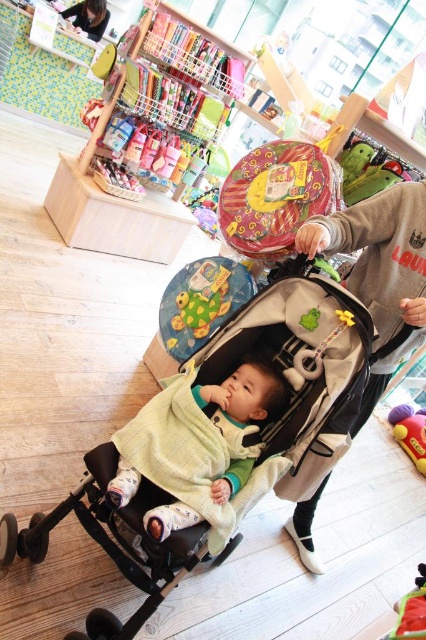
Identify the location of soft green blanket at center. (192, 445).

Is point (166, 524) farther from camera compared to point (411, 428)?

No.

The width and height of the screenshot is (426, 640). Find the location of `soft green blanket at center`. soft green blanket at center is located at coordinates (192, 445).

Is the position of soft green blanket at center less distant than that of matte black hair at upper left?

Yes, soft green blanket at center is in front of matte black hair at upper left.

Who is higher up, soft green blanket at center or matte black hair at upper left?

matte black hair at upper left

Which is in front, point (204, 394) or point (92, 20)?

Point (204, 394) is more forward.

You are a GUI agent. You are given a task and a screenshot of the screen. Output one action in this format:
    pyautogui.click(x=<x>, y=<y>)
    Task: Click on the soft green blanket at center
    The height and width of the screenshot is (640, 426).
    Given the screenshot: What is the action you would take?
    pyautogui.click(x=192, y=445)

Looking at this image, is black fabric baby carriage at center smaller than soft green blanket at center?

No, black fabric baby carriage at center is not smaller than soft green blanket at center.

Based on the photo, who is positioned more to the right, black fabric baby carriage at center or soft green blanket at center?

black fabric baby carriage at center

Who is more forward, (135, 556) or (166, 468)?

Positioned in front is point (166, 468).

Find the location of a particular element. The width and height of the screenshot is (426, 640). black fabric baby carriage at center is located at coordinates (293, 356).